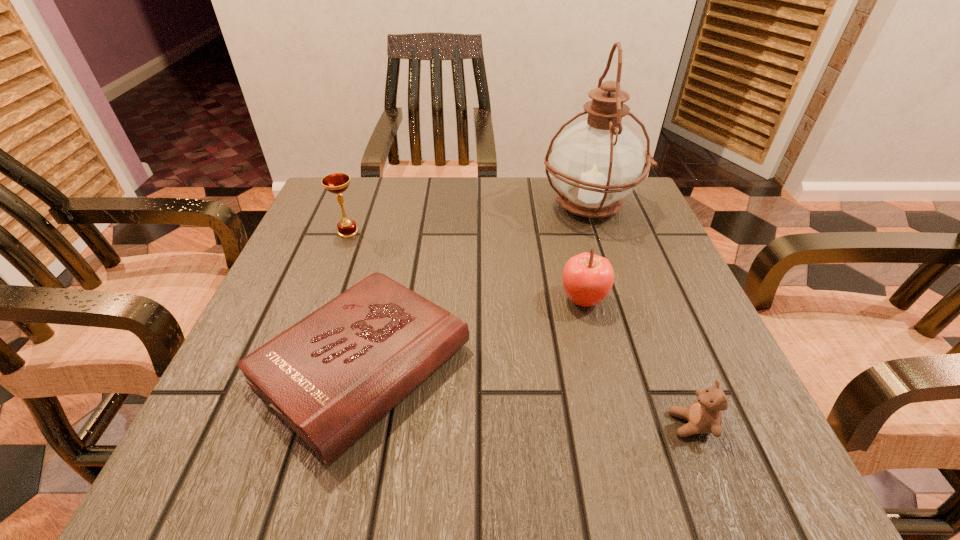
In order to click on free area in between the oil lamp and the hardback book in this screenshot , I will do `click(477, 285)`.

The width and height of the screenshot is (960, 540). What are the coordinates of `free space that is in between the second tallest object and the third tallest object` in the screenshot? It's located at click(466, 266).

Image resolution: width=960 pixels, height=540 pixels. Identify the location of unoccupied position between the hardback book and the apple. (473, 332).

Find the location of a particular element. The width and height of the screenshot is (960, 540). vacant area between the teddy bear and the oil lamp is located at coordinates (641, 315).

The image size is (960, 540). What are the coordinates of `unoccupied area between the fourth tallest object and the tallest object` in the screenshot? It's located at (641, 315).

Find the location of a particular element. The width and height of the screenshot is (960, 540). vacant space in between the teddy bear and the hardback book is located at coordinates (527, 394).

Locate an element on the screen. Image resolution: width=960 pixels, height=540 pixels. free space that is in between the fourth tallest object and the chalice is located at coordinates (519, 328).

Find the location of a particular element. The image size is (960, 540). object that is the fourth closest to the teddy bear is located at coordinates (336, 183).

This screenshot has height=540, width=960. In order to click on the third closest object to the apple in this screenshot , I will do `click(704, 416)`.

Find the location of a particular element. The width and height of the screenshot is (960, 540). vacant position in the image that satisfies the following two spatial constraints: 1. on the back side of the oil lamp; 2. on the right side of the hardback book is located at coordinates (401, 206).